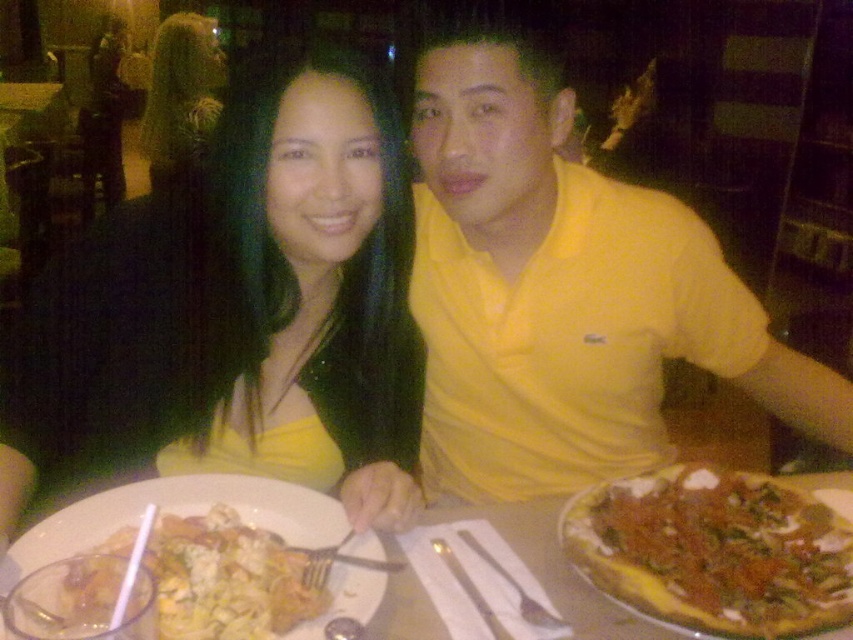
Between point (463, 362) and point (256, 483), which one is positioned in front?

Point (256, 483)

Which is more to the left, yellow matte shirt at center or white glossy plate at center?

From the viewer's perspective, white glossy plate at center appears more on the left side.

Which is in front, point (554, 419) or point (73, 540)?

Point (73, 540)

The image size is (853, 640). I want to click on yellow matte shirt at center, so click(563, 289).

I want to click on yellow matte dress at center, so click(x=241, y=307).

Is yellow matte dress at center positioned at the back of yellow matte shirt at center?

No.

Who is more distant from viewer, (283, 241) or (660, 456)?

Point (660, 456)

You are a GUI agent. You are given a task and a screenshot of the screen. Output one action in this format:
    pyautogui.click(x=<x>, y=<y>)
    Task: Click on the yellow matte dress at center
    Image resolution: width=853 pixels, height=640 pixels.
    Given the screenshot: What is the action you would take?
    pyautogui.click(x=241, y=307)

Who is more distant from viewer, (576, 625) or (178, 77)?

The point (178, 77) is more distant.

This screenshot has width=853, height=640. What do you see at coordinates (556, 570) in the screenshot?
I see `white glossy plate at center` at bounding box center [556, 570].

This screenshot has height=640, width=853. In order to click on white glossy plate at center in this screenshot , I will do `click(556, 570)`.